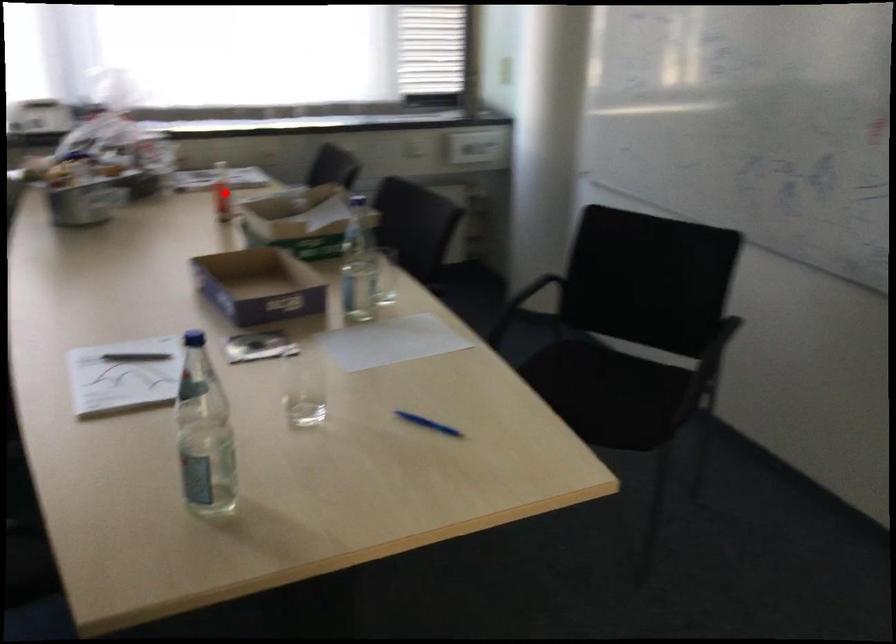
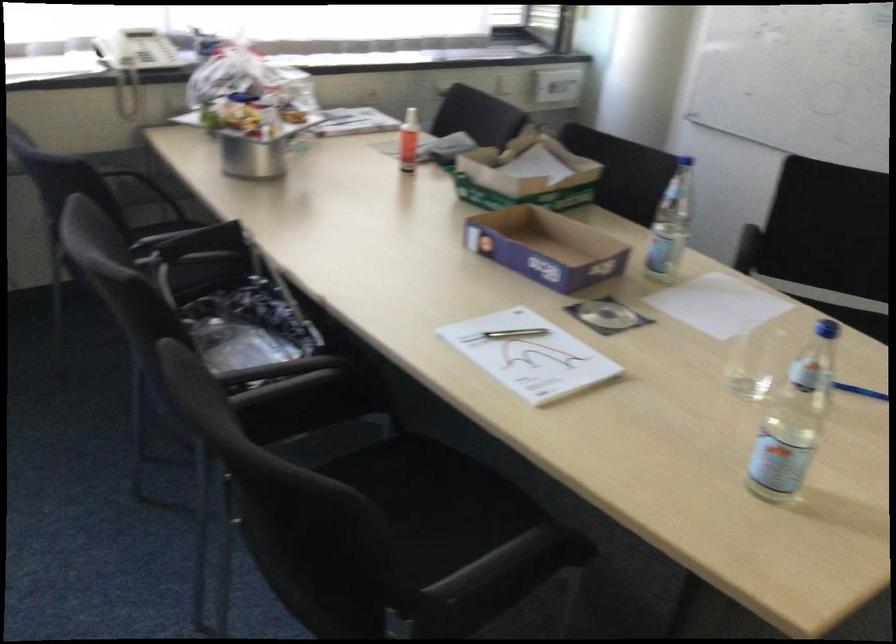
Locate, in the second image, the point that corresponds to the highlighted location in the first image.

(409, 140)